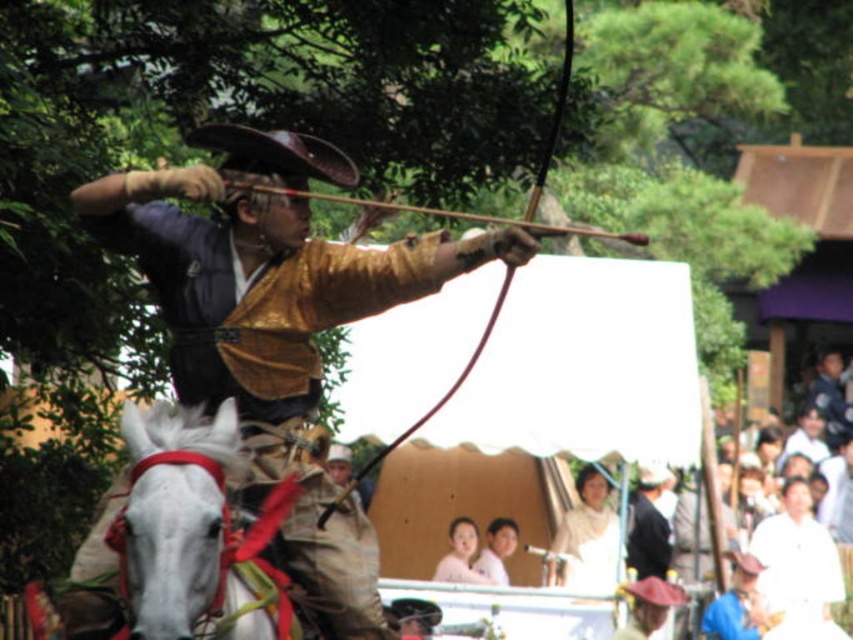
Question: Which object appears farthest from the camera in this image?

Choices:
 (A) smooth white face at center
 (B) smooth skin face at center
 (C) white glossy horse at left

Answer: (A)

Question: Considering the relative positions of white glossy horse at left and smooth white face at center in the image provided, where is white glossy horse at left located with respect to smooth white face at center?

Choices:
 (A) below
 (B) above

Answer: (B)

Question: Which of these objects is positioned farthest from the smooth skin face at center?

Choices:
 (A) white cotton kimono at center
 (B) shiny gold jacket at center
 (C) smooth white face at center

Answer: (B)

Question: Estimate the real-world distances between objects in this image. Which object is closer to the white cotton kimono at center?

Choices:
 (A) smooth white face at center
 (B) shiny gold jacket at center

Answer: (A)

Question: Is white glossy horse at left thinner than white cotton kimono at center?

Choices:
 (A) no
 (B) yes

Answer: (B)

Question: Does smooth skin face at center have a smaller size compared to smooth white face at center?

Choices:
 (A) no
 (B) yes

Answer: (A)